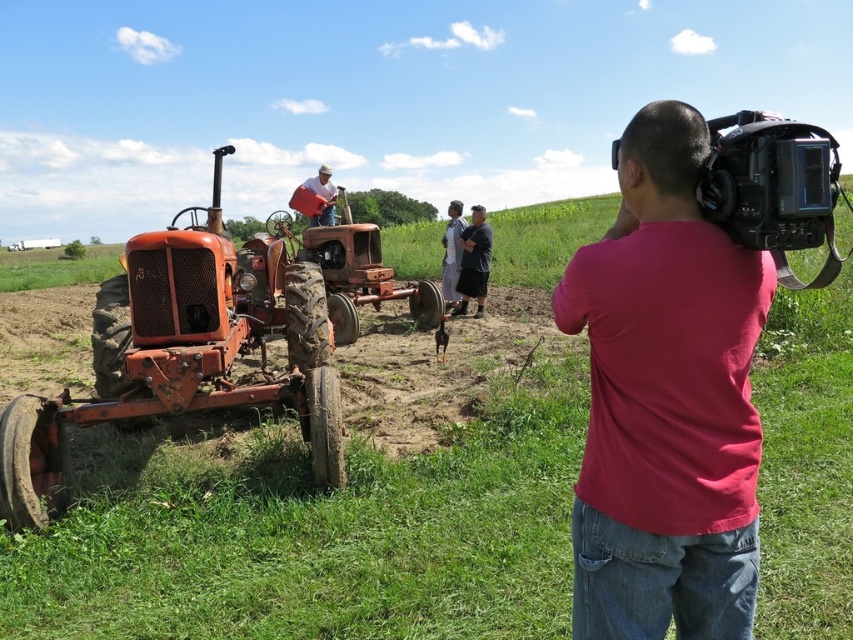
Between rustic metal tractor at left and pink cotton shirt at center, which one appears on the left side from the viewer's perspective?

Positioned to the left is rustic metal tractor at left.

Which is below, rustic metal tractor at left or pink cotton shirt at center?

pink cotton shirt at center is lower down.

Measure the distance between rustic metal tractor at left and camera.

They are 5.14 feet apart.

Image resolution: width=853 pixels, height=640 pixels. What are the coordinates of `rustic metal tractor at left` in the screenshot? It's located at (328, 508).

Is the position of black matte video camera at right less distant than that of gray fabric pants at center?

That is True.

Between black matte video camera at right and gray fabric pants at center, which one has less height?

gray fabric pants at center is shorter.

Is point (741, 224) closer to camera compared to point (450, 216)?

That is True.

Where is `black matte video camera at right`? black matte video camera at right is located at coordinates (770, 180).

Who is more distant from viewer, (763,212) or (480,282)?

The point (480,282) is behind.

Does black matte video camera at right appear on the right side of dark gray fabric shirt at center?

Indeed, black matte video camera at right is positioned on the right side of dark gray fabric shirt at center.

Which is in front, point (792, 125) or point (473, 244)?

Point (792, 125) is more forward.

Where is `black matte video camera at right`? This screenshot has width=853, height=640. black matte video camera at right is located at coordinates (770, 180).